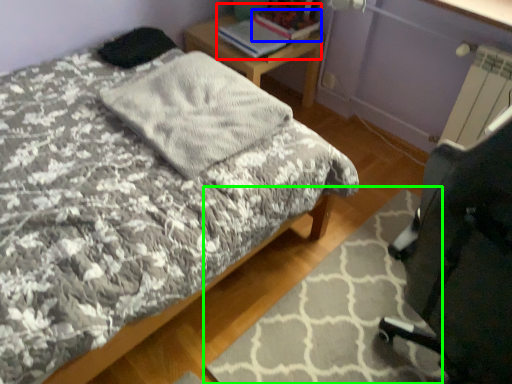
Question: Which object is the farthest from book (highlighted by a red box)? Choose among these: book (highlighted by a blue box) or mat (highlighted by a green box).

Choices:
 (A) book
 (B) mat

Answer: (B)